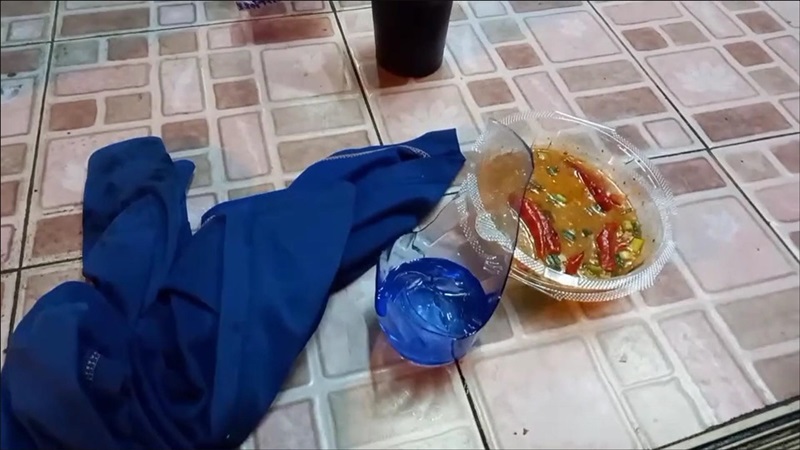
Locate an element on the screen. table is located at coordinates (721, 216).